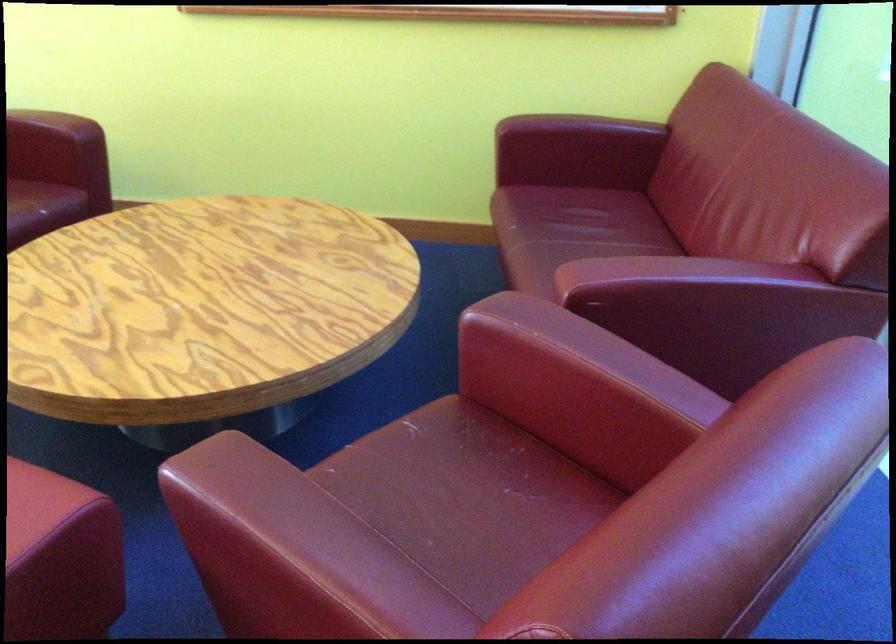
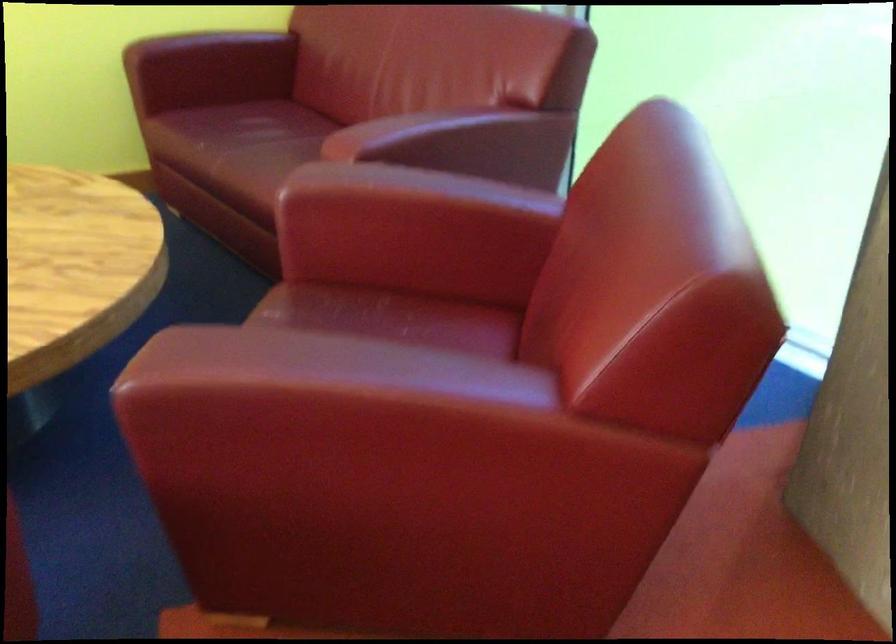
The point at (673, 292) is marked in the first image. Where is the corresponding point in the second image?

(438, 137)